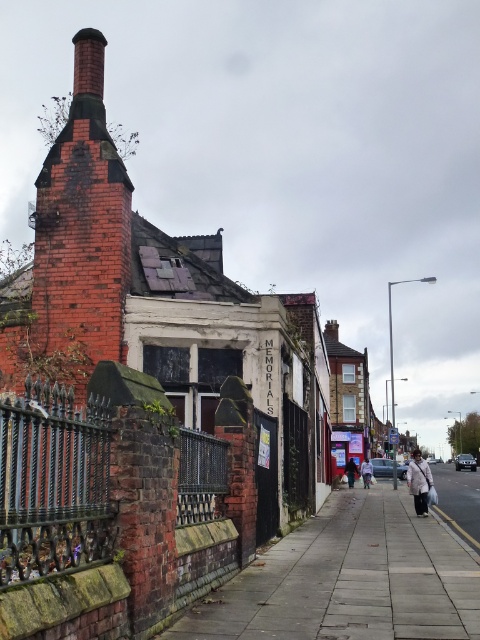
Does point (409, 480) come closer to viewer compared to point (354, 472)?

Yes.

This screenshot has width=480, height=640. Describe the element at coordinates (419, 481) in the screenshot. I see `light beige coat at center` at that location.

Identify the location of light beige coat at center. (419, 481).

Is light beige coat at center positioned behind light beige fabric coat at center?

That is False.

Between light beige coat at center and light beige fabric coat at center, which one has less height?

Standing shorter between the two is light beige fabric coat at center.

Is point (414, 481) less distant than point (364, 464)?

Yes, it is.

At what (x,y) coordinates should I click in order to perform the action: click on light beige coat at center. Please return your answer as a coordinate pair (x, y). The image size is (480, 640). Looking at the image, I should click on (419, 481).

Is smooth concrete pavement at center behind dark brown leather jacket at center?

No, smooth concrete pavement at center is in front of dark brown leather jacket at center.

Does smooth concrete pavement at center have a lesser height compared to dark brown leather jacket at center?

No.

This screenshot has height=640, width=480. Identify the location of smooth concrete pavement at center. (349, 579).